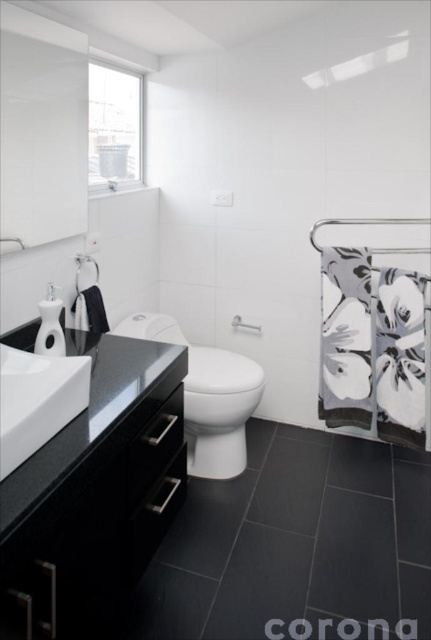
Based on the scene description, where is the white glossy sink at center located in the image?

The white glossy sink at center is located at point [37,401].

You are standing in the bathroom and want to turn on the water. Which object should you interact with first, the white glossy sink at center or the brushed metal faucet at upper left?

You should interact with the brushed metal faucet at upper left first because it is farther from the viewer than the white glossy sink at center, so you need to reach it before accessing the sink.